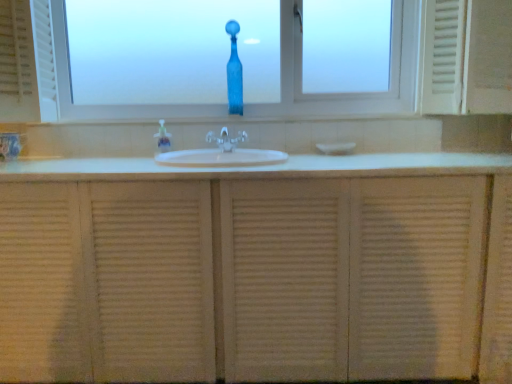
Measure the distance between white ceramic sink at center and camera.

A distance of 1.47 meters exists between white ceramic sink at center and camera.

At what (x,y) coordinates should I click in order to perform the action: click on white matte bar of soap at center. Please return your answer as a coordinate pair (x, y). This screenshot has width=512, height=384. Looking at the image, I should click on (336, 148).

What is the approximate height of white textured medicine cabinet at right?

white textured medicine cabinet at right is 52.26 centimeters in height.

Measure the distance between white textured medicine cabinet at right and camera.

A distance of 5.09 feet exists between white textured medicine cabinet at right and camera.

This screenshot has height=384, width=512. Describe the element at coordinates (489, 57) in the screenshot. I see `transparent glass window at center` at that location.

This screenshot has height=384, width=512. In order to click on white textured cabinet at center in this screenshot , I will do `click(256, 269)`.

Between white textured cabinet at center and blue glass vase at center, which one has larger width?

white textured cabinet at center.

Which of these two, white textured cabinet at center or blue glass vase at center, is smaller?

blue glass vase at center.

Which object is positioned more to the right, white textured cabinet at center or blue glass vase at center?

From the viewer's perspective, white textured cabinet at center appears more on the right side.

How far apart are white textured cabinet at center and blue glass vase at center?

white textured cabinet at center and blue glass vase at center are 1.03 meters apart from each other.

From the image's perspective, which object appears higher, white textured cabinet at center or transparent glass window at center?

transparent glass window at center, from the image's perspective.

Is white textured cabinet at center inside or outside of transparent glass window at center?

white textured cabinet at center exists outside the volume of transparent glass window at center.

Is white textured cabinet at center positioned with its back to transparent glass window at center?

That's not correct — white textured cabinet at center is not looking away from transparent glass window at center.

Between blue glass vase at center and white ceramic sink at center, which one appears on the right side from the viewer's perspective?

blue glass vase at center.

How distant is blue glass vase at center from white ceramic sink at center?

blue glass vase at center is 21.69 inches from white ceramic sink at center.

Is blue glass vase at center spatially inside white ceramic sink at center, or outside of it?

blue glass vase at center is not enclosed by white ceramic sink at center.

From a real-world perspective, is blue glass vase at center on white ceramic sink at center?

Indeed, from a real-world perspective, blue glass vase at center stands above white ceramic sink at center.

Considering the sizes of objects translucent plastic soap dispenser at center and white matte bar of soap at center in the image provided, who is thinner, translucent plastic soap dispenser at center or white matte bar of soap at center?

translucent plastic soap dispenser at center is thinner.

Is translucent plastic soap dispenser at center bigger than white matte bar of soap at center?

No.

From a real-world perspective, is translucent plastic soap dispenser at center beneath white matte bar of soap at center?

Actually, translucent plastic soap dispenser at center is physically above white matte bar of soap at center in the real world.

Would you consider translucent plastic soap dispenser at center to be distant from white matte bar of soap at center?

That's not correct — translucent plastic soap dispenser at center is a little close to white matte bar of soap at center.

Between transparent glass window at center and white textured cabinet at center, which one appears on the right side from the viewer's perspective?

white textured cabinet at center is more to the right.

From a real-world perspective, is transparent glass window at center above or below white textured cabinet at center?

In terms of real-world spatial position, transparent glass window at center is above white textured cabinet at center.

Based on the photo, from the image's perspective, between transparent glass window at center and white textured cabinet at center, which one is located above?

transparent glass window at center appears higher in the image.

Can you tell me how much transparent glass window at center and white textured cabinet at center differ in facing direction?

transparent glass window at center and white textured cabinet at center are facing 0.0976 degrees away from each other.

Looking at this image, from a real-world perspective, is white matte bar of soap at center under white textured medicine cabinet at right?

Indeed, from a real-world perspective, white matte bar of soap at center is positioned beneath white textured medicine cabinet at right.

How many degrees apart are the facing directions of white matte bar of soap at center and white textured medicine cabinet at right?

The angular difference between white matte bar of soap at center and white textured medicine cabinet at right is 2.24 degrees.

Considering their positions, is white matte bar of soap at center located in front of or behind white textured medicine cabinet at right?

Clearly, white matte bar of soap at center is behind white textured medicine cabinet at right.

Consider the image. Is white matte bar of soap at center facing towards white textured medicine cabinet at right?

No, white matte bar of soap at center is not oriented towards white textured medicine cabinet at right.

Consider the image. Considering the relative sizes of white ceramic sink at center and blue glass vase at center in the image provided, is white ceramic sink at center bigger than blue glass vase at center?

Yes.

Is point (251, 164) more distant than point (228, 28)?

No.

Is white ceramic sink at center not close to blue glass vase at center?

No, there isn't a large distance between white ceramic sink at center and blue glass vase at center.

Find the location of a particular element. sink on the left of blue glass vase at center is located at coordinates (220, 158).

The height and width of the screenshot is (384, 512). Find the location of `glass vase that appears behind the white textured cabinet at center`. glass vase that appears behind the white textured cabinet at center is located at coordinates (234, 72).

In the image, there is a transparent glass window at center. What are the coordinates of `bathroom cabinet below it (from the image's perspective)` in the screenshot? It's located at (256, 269).

When comparing their distances from white matte bar of soap at center, does white textured cabinet at center or transparent glass window at center seem further?

Based on the image, white textured cabinet at center appears to be further to white matte bar of soap at center.

Considering their positions, is white ceramic sink at center positioned closer to transparent glass window at center than white textured medicine cabinet at right?

white textured medicine cabinet at right is positioned closer to the anchor transparent glass window at center.

Considering their positions, is clear plastic faucet at center positioned further to blue glass vase at center than white textured cabinet at center?

white textured cabinet at center lies further to blue glass vase at center than the other object.

Which object lies nearer to the anchor point blue glass vase at center, white textured cabinet at center or clear plastic faucet at center?

The object closer to blue glass vase at center is clear plastic faucet at center.

Estimate the real-world distances between objects in this image. Which object is further from white textured cabinet at center, translucent plastic soap dispenser at center or white ceramic sink at center?

Among the two, translucent plastic soap dispenser at center is located further to white textured cabinet at center.

Considering their positions, is white matte bar of soap at center positioned closer to translucent plastic soap dispenser at center than blue glass vase at center?

Among the two, blue glass vase at center is located nearer to translucent plastic soap dispenser at center.

Considering their positions, is transparent glass window at center positioned further to blue glass vase at center than translucent plastic soap dispenser at center?

Among the two, transparent glass window at center is located further to blue glass vase at center.

Considering their positions, is white ceramic sink at center positioned closer to transparent glass window at center than clear plastic faucet at center?

Based on the image, white ceramic sink at center appears to be nearer to transparent glass window at center.

Find the location of `sink located between translucent plastic soap dispenser at center and white textured cabinet at center in the left-right direction`. sink located between translucent plastic soap dispenser at center and white textured cabinet at center in the left-right direction is located at coordinates (220, 158).

This screenshot has height=384, width=512. Find the location of `soap between white textured medicine cabinet at right and white textured cabinet at center in the up-down direction`. soap between white textured medicine cabinet at right and white textured cabinet at center in the up-down direction is located at coordinates (336, 148).

Locate an element on the screen. soap dispenser between blue glass vase at center and white ceramic sink at center from top to bottom is located at coordinates (163, 138).

Identify the location of tap located between translucent plastic soap dispenser at center and white textured medicine cabinet at right in the left-right direction. (226, 139).